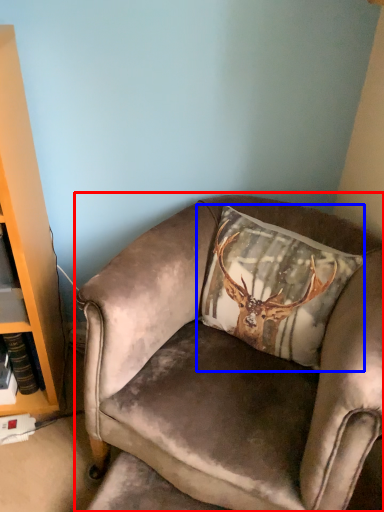
Question: Which object appears closest to the camera in this image, chair (highlighted by a red box) or pillow (highlighted by a blue box)?

Choices:
 (A) chair
 (B) pillow

Answer: (A)